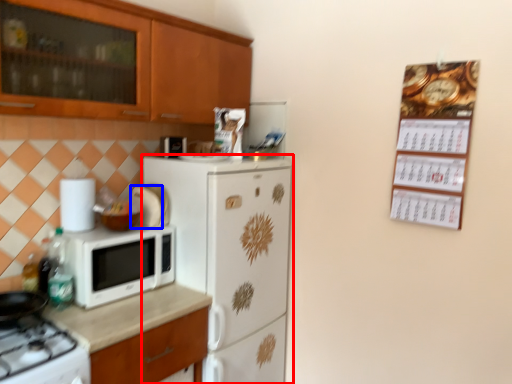
Question: Which point is further to the camera, refrigerator (highlighted by a red box) or appliance (highlighted by a blue box)?

Choices:
 (A) refrigerator
 (B) appliance

Answer: (B)